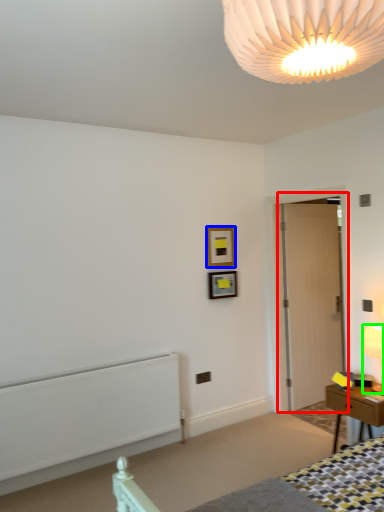
Question: Considering the real-world distances, which object is farthest from door (highlighted by a red box)? picture frame (highlighted by a blue box) or lamp (highlighted by a green box)?

Choices:
 (A) picture frame
 (B) lamp

Answer: (B)